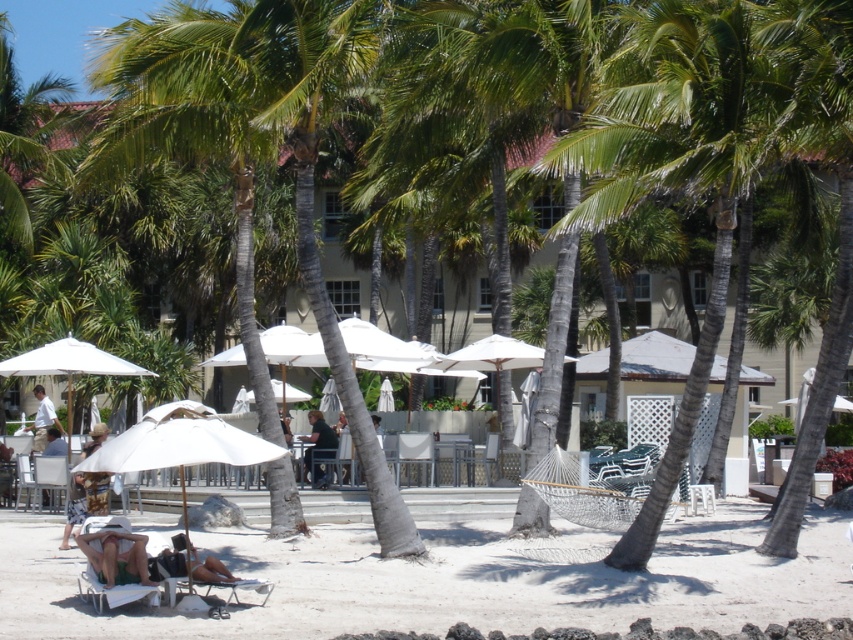
I want to click on white sand at lower left, so click(x=454, y=579).

At what (x,y) coordinates should I click in order to perform the action: click on white sand at lower left. Please return your answer as a coordinate pair (x, y). The width and height of the screenshot is (853, 640). Looking at the image, I should click on (454, 579).

Which of these two, white matte umbrella at lower left or dark blue shirt at center, stands taller?

With more height is white matte umbrella at lower left.

Is white matte umbrella at lower left to the right of dark blue shirt at center from the viewer's perspective?

No, white matte umbrella at lower left is not to the right of dark blue shirt at center.

Does point (235, 458) come farther from viewer compared to point (309, 464)?

No, it is not.

Locate an element on the screen. white matte umbrella at lower left is located at coordinates (180, 444).

Between white sand at lower left and white shirt at center, which one has more height?

white shirt at center

Can you confirm if white sand at lower left is wider than white shirt at center?

Correct, the width of white sand at lower left exceeds that of white shirt at center.

Locate an element on the screen. The height and width of the screenshot is (640, 853). white sand at lower left is located at coordinates (454, 579).

Where is `white sand at lower left`? The width and height of the screenshot is (853, 640). white sand at lower left is located at coordinates (454, 579).